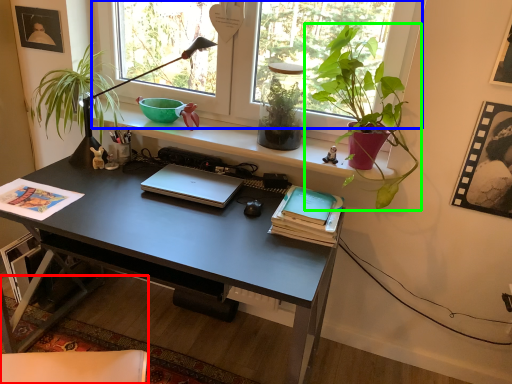
Question: Which object is positioned farthest from swivel chair (highlighted by a red box)? Select from window (highlighted by a blue box) and houseplant (highlighted by a green box).

Choices:
 (A) window
 (B) houseplant

Answer: (A)